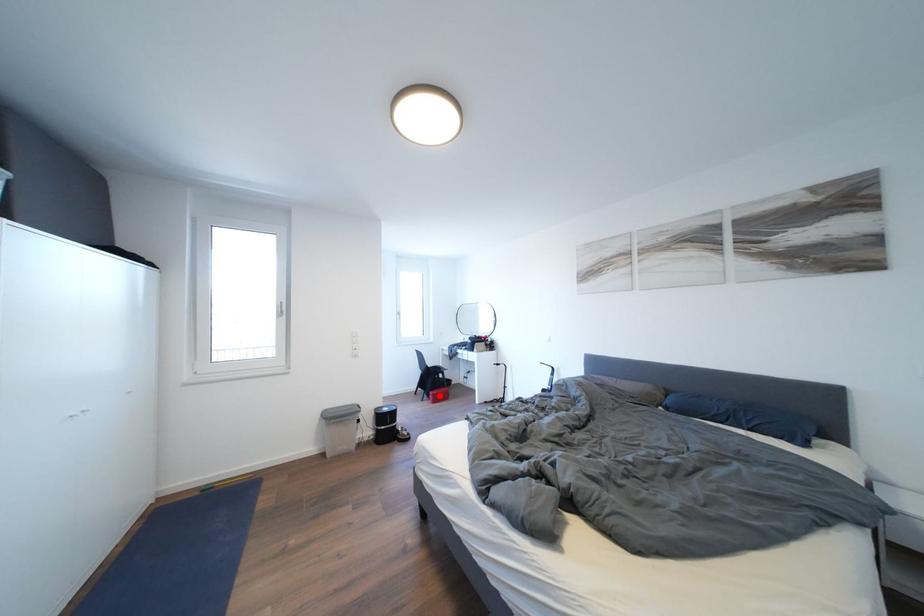
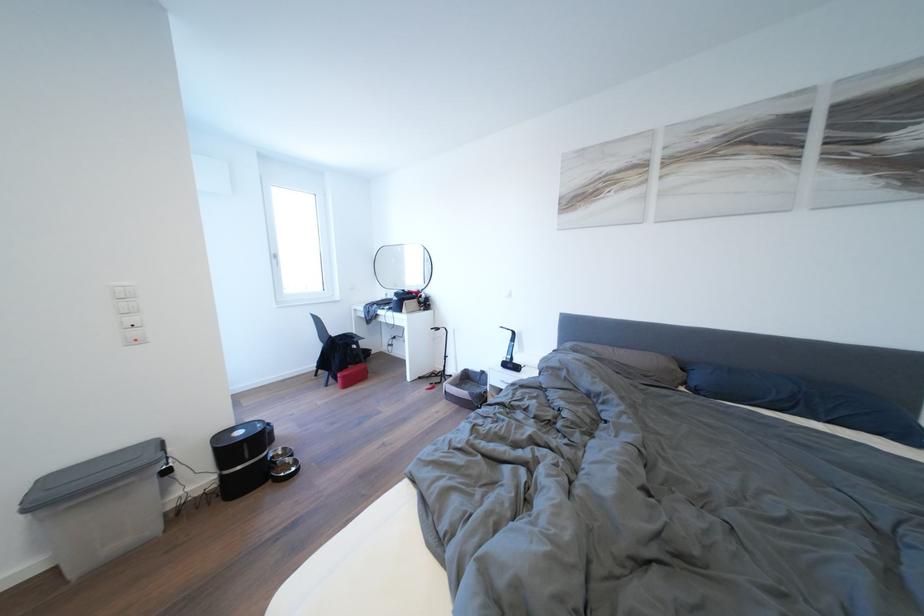
Question: I am providing you with two images of the same scene from different viewpoints. A red point is shown in image1. For the corresponding object point in image2, is it positioned nearer or farther from the camera?

Choices:
 (A) Nearer
 (B) Farther

Answer: (A)